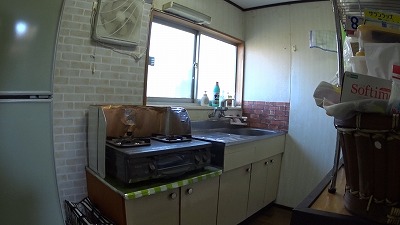
The image size is (400, 225). I want to click on soap, so click(x=205, y=99).